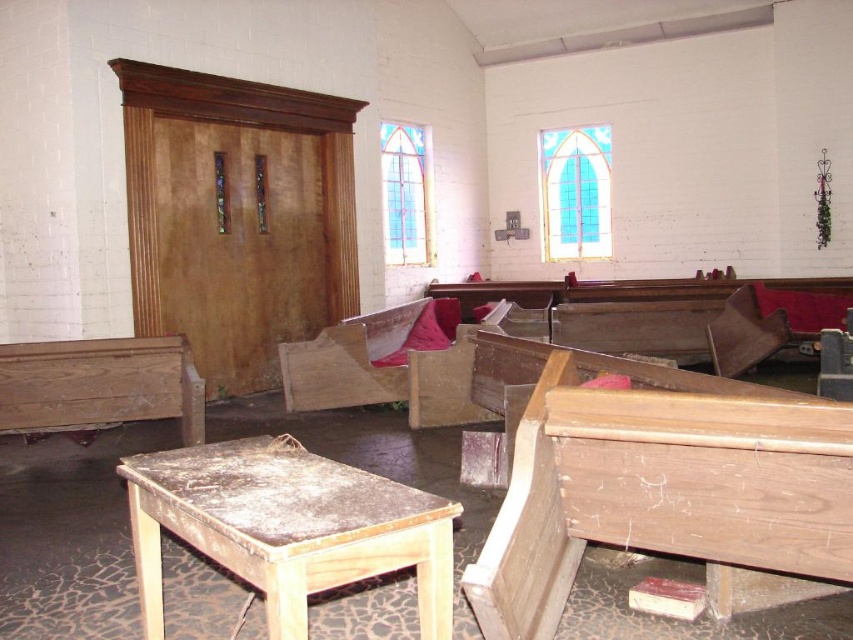
Is wooden bench at left thinner than wooden chair at right?

No.

Is point (62, 394) positioned in front of point (712, 356)?

Yes, it is.

Locate an element on the screen. wooden bench at left is located at coordinates (99, 385).

Looking at this image, does wooden table at lower left have a lesser height compared to wooden bench at left?

Correct, wooden table at lower left is not as tall as wooden bench at left.

Does wooden table at lower left appear on the left side of wooden bench at left?

Incorrect, wooden table at lower left is not on the left side of wooden bench at left.

At what (x,y) coordinates should I click in order to perform the action: click on wooden table at lower left. Please return your answer as a coordinate pair (x, y). Looking at the image, I should click on (287, 528).

Between point (178, 492) and point (730, 346), which one is positioned behind?

The point (730, 346) is behind.

Does wooden table at lower left appear on the left side of wooden chair at right?

A: Correct, you'll find wooden table at lower left to the left of wooden chair at right.

Who is more distant from viewer, [155,493] or [746,308]?

The point [746,308] is behind.

Where is `wooden table at lower left`? This screenshot has width=853, height=640. wooden table at lower left is located at coordinates (287, 528).